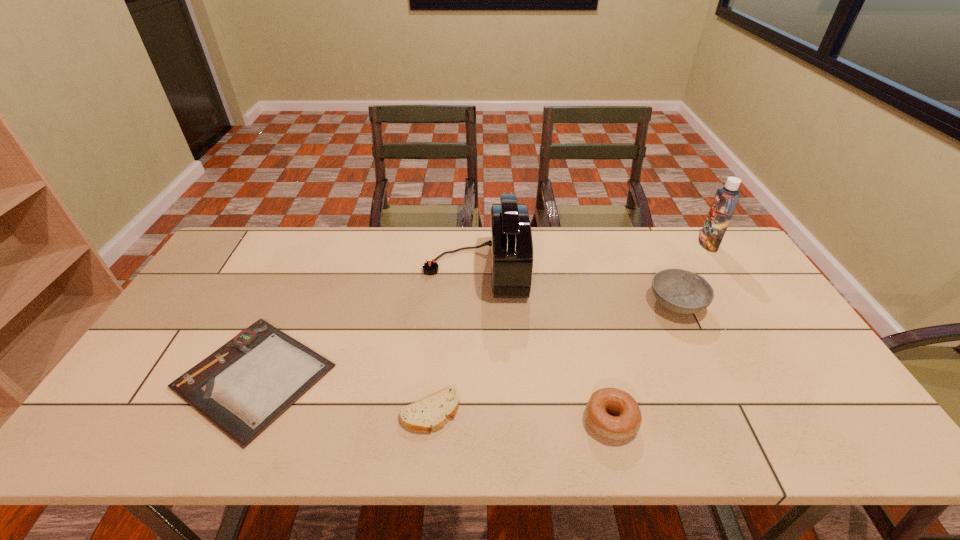
Identify the location of the rightmost object. This screenshot has height=540, width=960. (726, 199).

Where is `radio receiver`? radio receiver is located at coordinates (511, 246).

Identify the location of the fifth object from left to right. Image resolution: width=960 pixels, height=540 pixels. (683, 292).

Locate an element on the screen. The image size is (960, 540). bowl is located at coordinates (683, 292).

Where is `the fourth object from left to right`? This screenshot has width=960, height=540. the fourth object from left to right is located at coordinates click(626, 423).

Where is `bagel`? This screenshot has width=960, height=540. bagel is located at coordinates pyautogui.click(x=626, y=423).

Identify the location of the fifth tallest object. This screenshot has width=960, height=540. (431, 413).

Where is `clipboard`? clipboard is located at coordinates (244, 386).

Locate an element on the screen. This screenshot has width=960, height=540. the shortest object is located at coordinates (244, 386).

This screenshot has width=960, height=540. I want to click on vacant position located 0.090m on the front label of the rightmost object, so click(x=674, y=244).